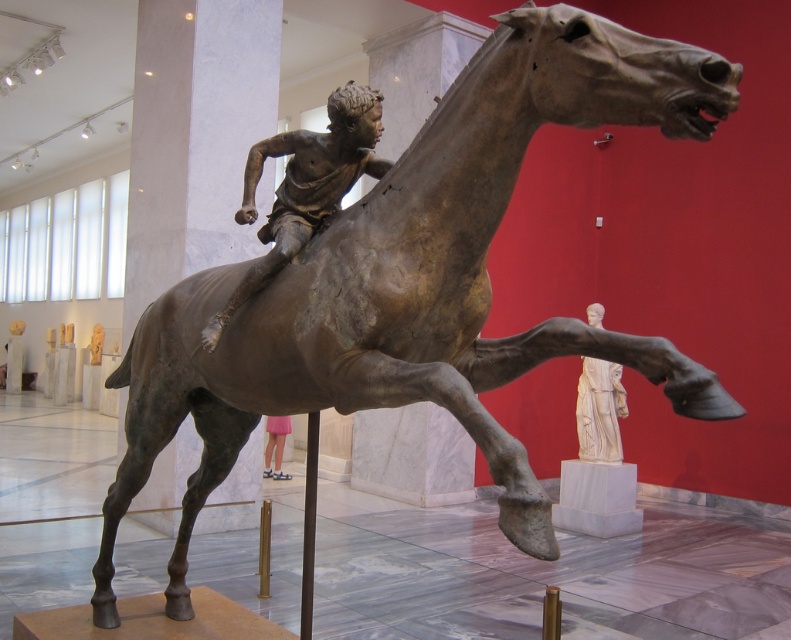
You are an art curator planning to move the bronze figure at center and the white marble statue at right to a new exhibition space. The new space has a strict height limit of 2 meters. Given their sizes, which of the two sculptures might exceed the height limit?

The bronze figure at center is bigger than the white marble statue at right. Therefore, the bronze figure at center is more likely to exceed the 2 meters height limit.

You are standing in front of the sculpture and want to take a photo of both the bronze figure at center and the pink fabric skirt at lower center. Which object should you pan your camera to the left to include in the frame first?

The pink fabric skirt at lower center should be panned to the left first because the bronze figure at center is to the right of it.